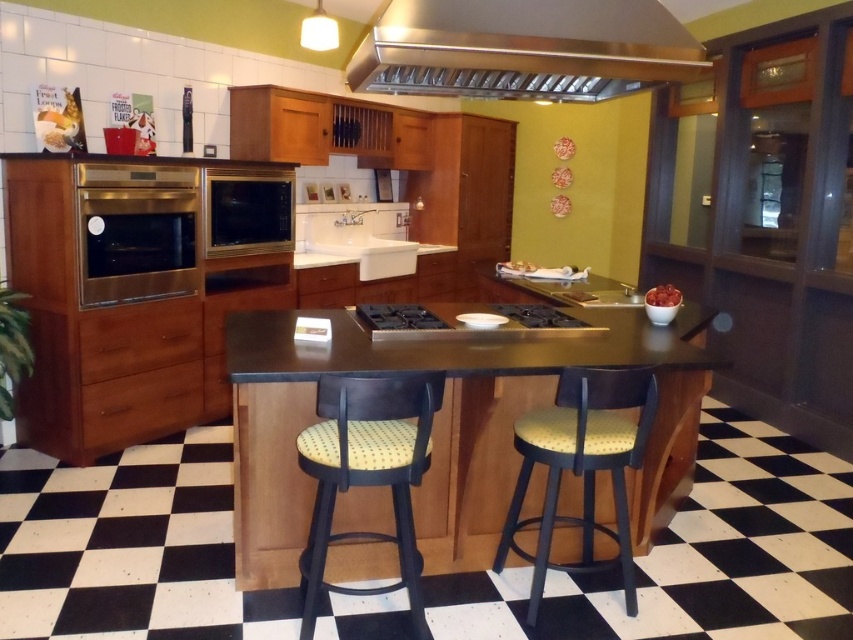
Question: Among these objects, which one is nearest to the camera?

Choices:
 (A) stainless steel exhaust hood at upper center
 (B) yellow dotted fabric stool at center

Answer: (A)

Question: Which point is closer to the camera taking this photo?

Choices:
 (A) (254, 355)
 (B) (589, 6)

Answer: (A)

Question: Which point is farther to the camera?

Choices:
 (A) satin gold microwave at center
 (B) brown wood counter top at center

Answer: (A)

Question: Is brown wood counter top at center above black stainless steel stove at center?

Choices:
 (A) yes
 (B) no

Answer: (B)

Question: Is stainless steel exhaust hood at upper center below yellow fabric stool at center?

Choices:
 (A) yes
 (B) no

Answer: (B)

Question: Does brown wood counter top at center appear on the right side of satin gold microwave at center?

Choices:
 (A) no
 (B) yes

Answer: (B)